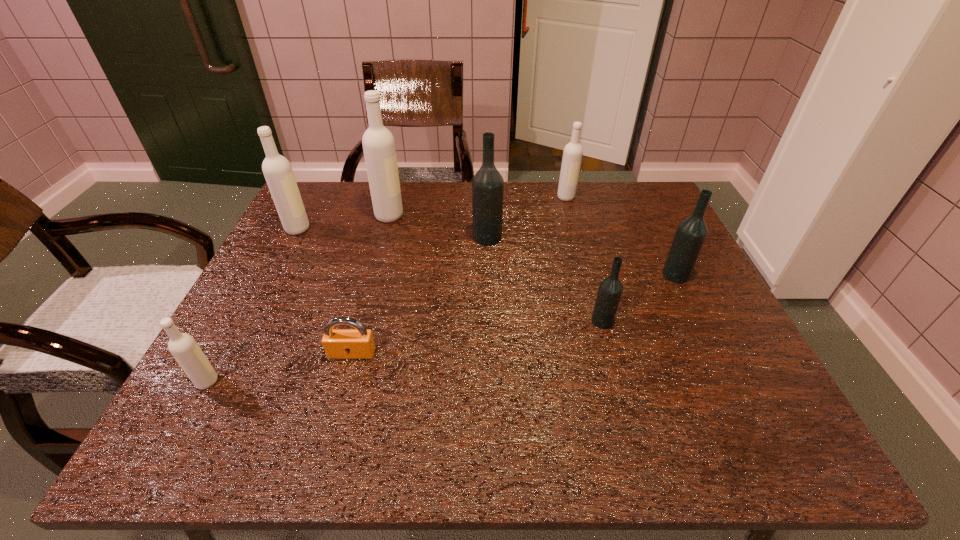
This screenshot has height=540, width=960. Find the location of `the tallest object`. the tallest object is located at coordinates 378,142.

Locate an element on the screen. the third white vodka from left to right is located at coordinates (378, 142).

At what (x,y) coordinates should I click in order to perform the action: click on the fourth vodka from left to right. Please return your answer as a coordinate pair (x, y). This screenshot has width=960, height=540. Looking at the image, I should click on (488, 184).

Where is `the biggest black vodka`? This screenshot has height=540, width=960. the biggest black vodka is located at coordinates (488, 184).

The image size is (960, 540). I want to click on the second biggest white vodka, so click(277, 170).

Identify the location of the farthest object. Image resolution: width=960 pixels, height=540 pixels. (572, 155).

Find the location of a particular element. This screenshot has height=540, width=960. the second smallest white vodka is located at coordinates (572, 155).

Locate an element on the screen. Image resolution: width=960 pixels, height=540 pixels. the second nearest black vodka is located at coordinates (691, 233).

Where is `the rightmost black vodka`? the rightmost black vodka is located at coordinates (691, 233).

This screenshot has width=960, height=540. Find the location of `the smallest white vodka`. the smallest white vodka is located at coordinates (183, 347).